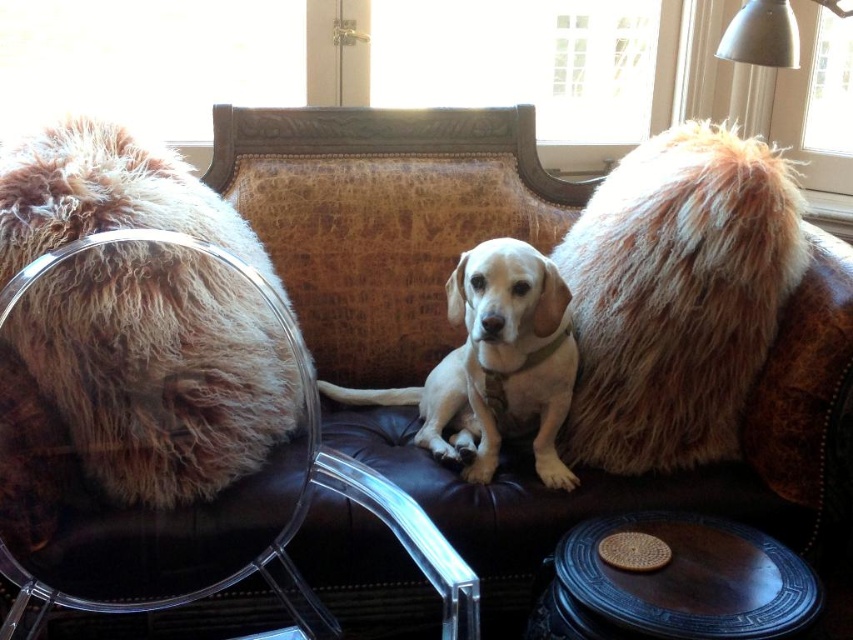
Question: Which point appears farthest from the camera in this image?

Choices:
 (A) (97, 339)
 (B) (109, 477)
 (C) (476, 296)

Answer: (C)

Question: Does fuzzy brown fur at center have a lesser width compared to white fur dog at center?

Choices:
 (A) no
 (B) yes

Answer: (A)

Question: Does brown textured armchair at center lie in front of fuzzy brown fur at center?

Choices:
 (A) no
 (B) yes

Answer: (B)

Question: Which of the following is the farthest from the observer?

Choices:
 (A) dark brown wooden stool at center
 (B) fuzzy brown fur at center
 (C) brown textured armchair at center
 (D) white fur dog at center

Answer: (D)

Question: Which point is farther to the camera?

Choices:
 (A) [264, 269]
 (B) [556, 333]
 (C) [583, 602]

Answer: (A)

Question: Is brown textured armchair at center to the right of white fur dog at center from the viewer's perspective?

Choices:
 (A) no
 (B) yes

Answer: (A)